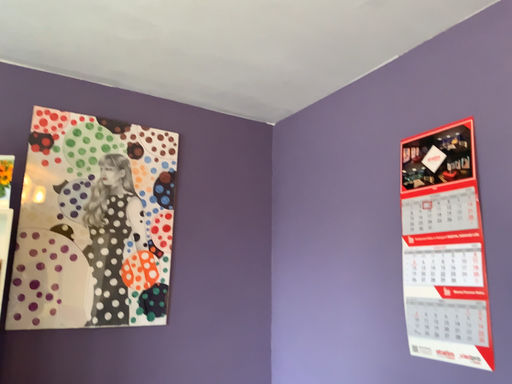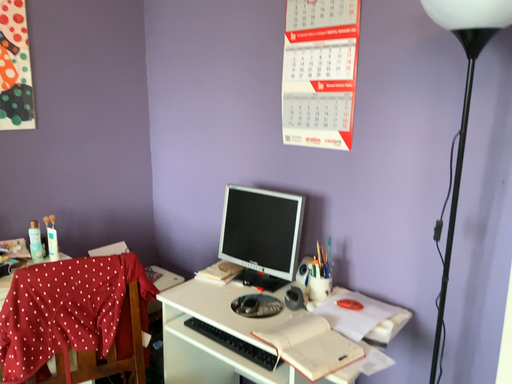
Question: Which way did the camera rotate in the video?

Choices:
 (A) rotated right
 (B) rotated left

Answer: (A)